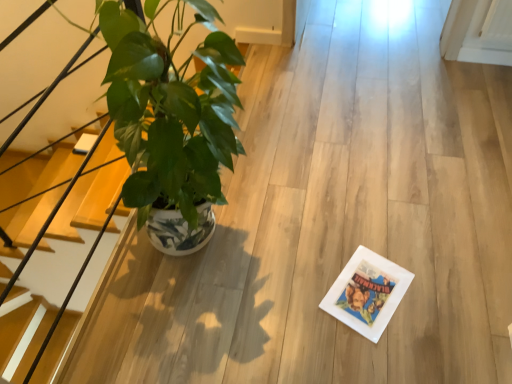
The height and width of the screenshot is (384, 512). I want to click on vacant space underneath green glossy plant at left (from a real-world perspective), so click(204, 246).